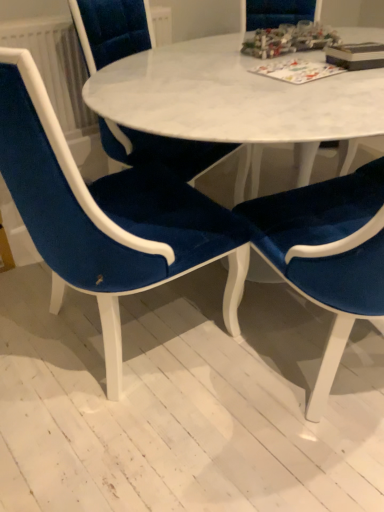
Where is `free space in front of velvet blue chair at lower left, which is the 1th chair from left to right`? free space in front of velvet blue chair at lower left, which is the 1th chair from left to right is located at coordinates (132, 448).